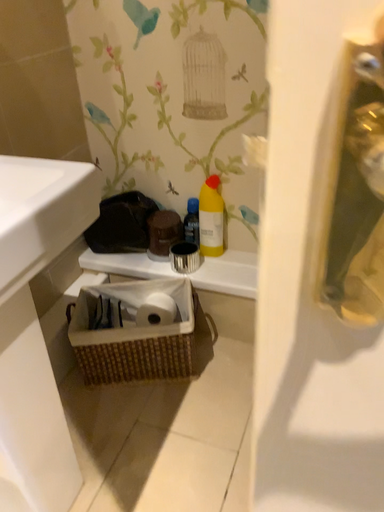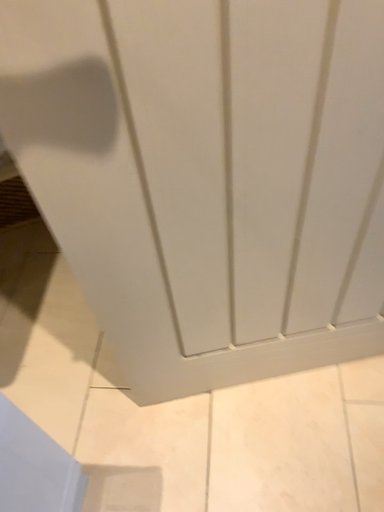
Question: Which way did the camera rotate in the video?

Choices:
 (A) rotated upward
 (B) rotated downward

Answer: (B)